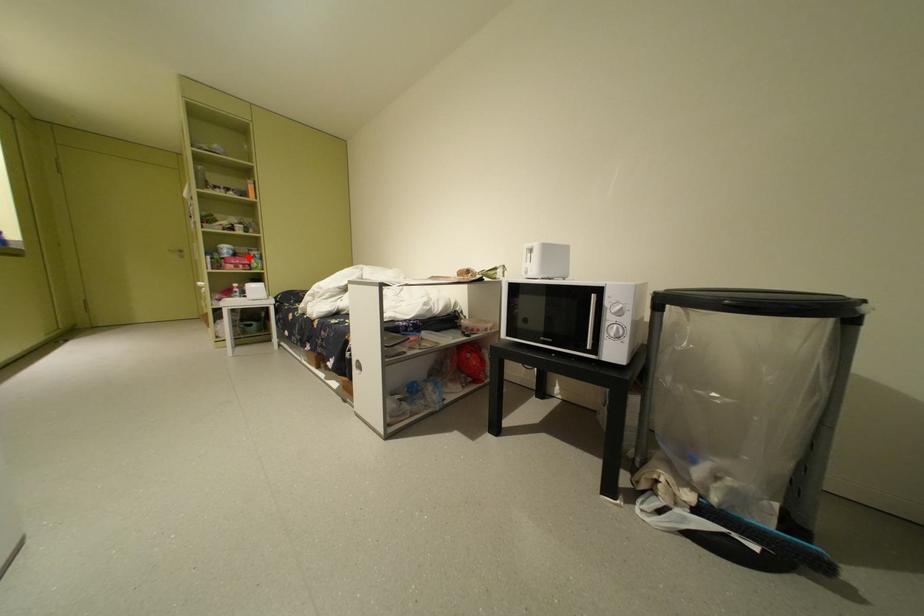
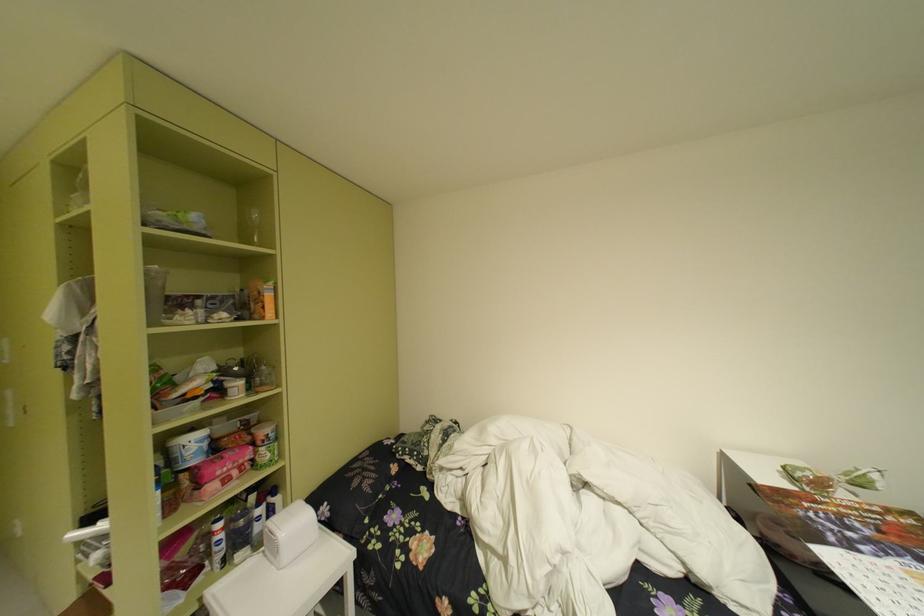
The point at the highlighted location is marked in the first image. Where is the corresponding point in the second image?

(238, 455)